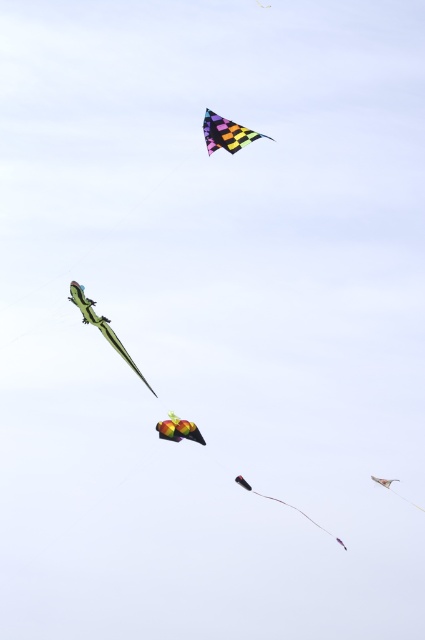
Question: Which is nearer to the green matte lizard at left?

Choices:
 (A) black matte kite at center
 (B) metallic silver kite at upper right
 (C) shiny silver kite at lower right

Answer: (A)

Question: Is shiny silver kite at lower right smaller than metallic silver kite at upper right?

Choices:
 (A) yes
 (B) no

Answer: (B)

Question: Considering the relative positions of shiny metallic fruit at center and black matte kite at center in the image provided, where is shiny metallic fruit at center located with respect to black matte kite at center?

Choices:
 (A) below
 (B) above

Answer: (B)

Question: Which of the following is the closest to the observer?

Choices:
 (A) (240, 145)
 (B) (180, 435)
 (C) (79, 296)

Answer: (C)

Question: Which point appears farthest from the camera in this image?

Choices:
 (A) coord(221,131)
 (B) coord(116,337)
 (C) coord(382,481)
 (D) coord(190,435)

Answer: (D)

Question: Does green matte lizard at left have a lesser width compared to black matte kite at center?

Choices:
 (A) yes
 (B) no

Answer: (A)